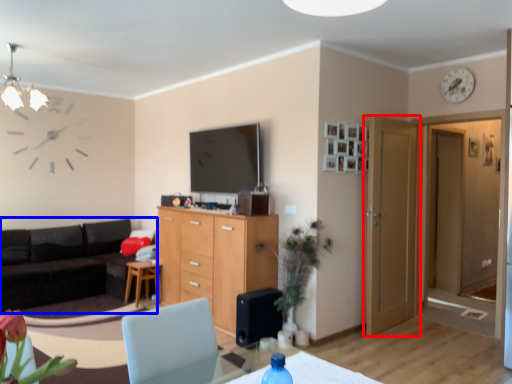
Question: Which object appears farthest to the camera in this image, door (highlighted by a red box) or studio couch (highlighted by a blue box)?

Choices:
 (A) door
 (B) studio couch

Answer: (B)